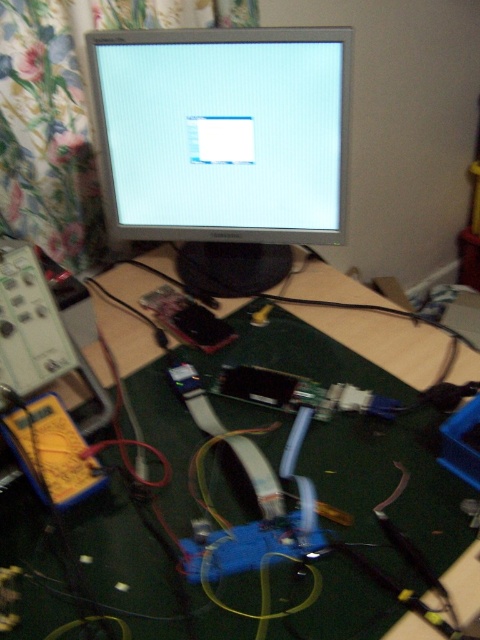
Who is more distant from viewer, (117, 163) or (108, 372)?

Point (117, 163)

Who is more distant from viewer, (149, 42) or (351, 324)?

The point (351, 324) is more distant.

Locate an element on the screen. silver metallic monitor at center is located at coordinates (224, 145).